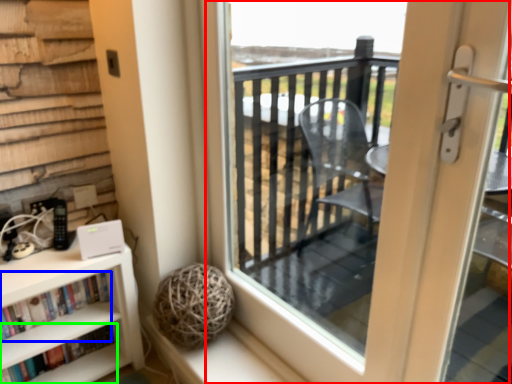
Question: Which is nearer to the screen door (highlighted by a red box)? book (highlighted by a blue box) or book (highlighted by a green box).

Choices:
 (A) book
 (B) book

Answer: (A)